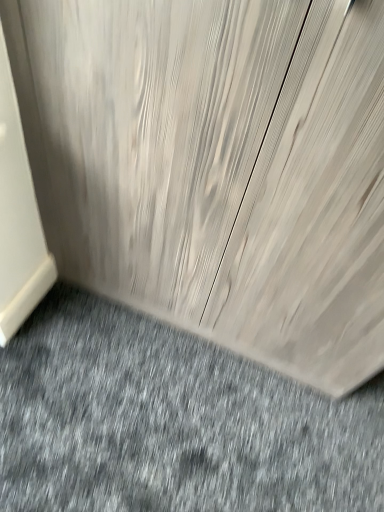
What are the coordinates of `natural wood cabinet at center` in the screenshot? It's located at coord(171,423).

What do you see at coordinates (171, 423) in the screenshot?
I see `natural wood cabinet at center` at bounding box center [171, 423].

The height and width of the screenshot is (512, 384). Identify the location of natural wood cabinet at center. (171, 423).